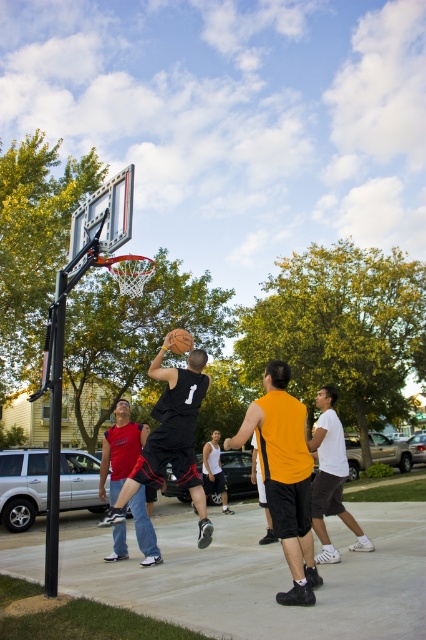
Is point (279, 410) more distant than point (313, 444)?

That is False.

Is orange jersey at center taller than white matte basketball at center?

Yes, orange jersey at center is taller than white matte basketball at center.

Between point (301, 472) and point (325, 490), which one is positioned behind?

Positioned behind is point (325, 490).

Find the location of a particular element. The width and height of the screenshot is (426, 640). orange jersey at center is located at coordinates (284, 476).

Does matte black basketball at center appear over black matte basketball at center?

Actually, matte black basketball at center is below black matte basketball at center.

Is matte black basketball at center positioned before black matte basketball at center?

Yes, matte black basketball at center is closer to the viewer.

The image size is (426, 640). I want to click on matte black basketball at center, so click(x=284, y=476).

You are a GUI agent. You are given a task and a screenshot of the screen. Output one action in this format:
    pyautogui.click(x=<x>, y=<y>)
    Task: Click on the matte black basketball at center
    Image resolution: width=426 pixels, height=640 pixels.
    Given the screenshot: What is the action you would take?
    pyautogui.click(x=284, y=476)

Does black matte basketball at center appear under white matte basketball at center?

No.

Which is behind, point (161, 355) or point (357, 525)?

Positioned behind is point (357, 525).

I want to click on black matte basketball at center, so click(169, 442).